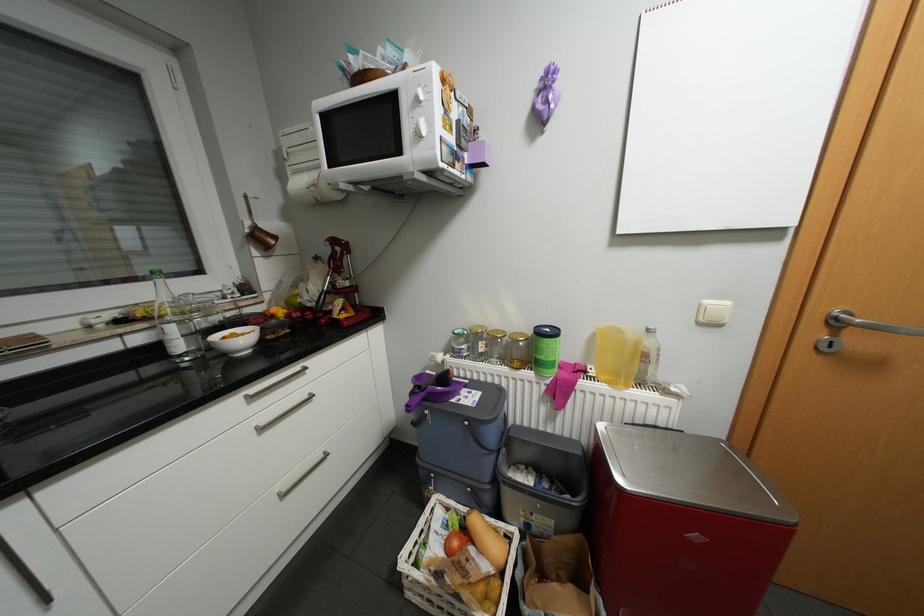
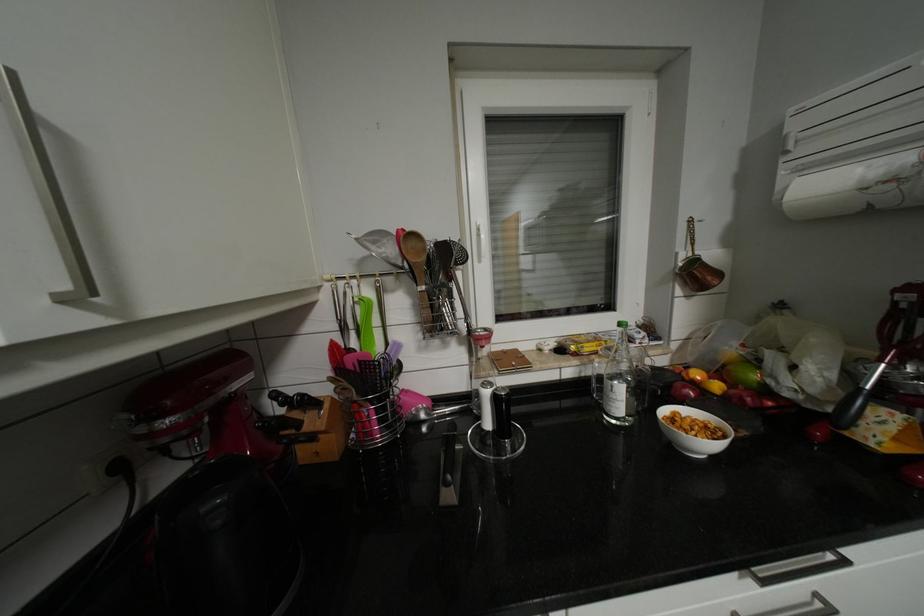
Where in the second image is the point corresponding to point 249,339 from the first image?

(703, 430)